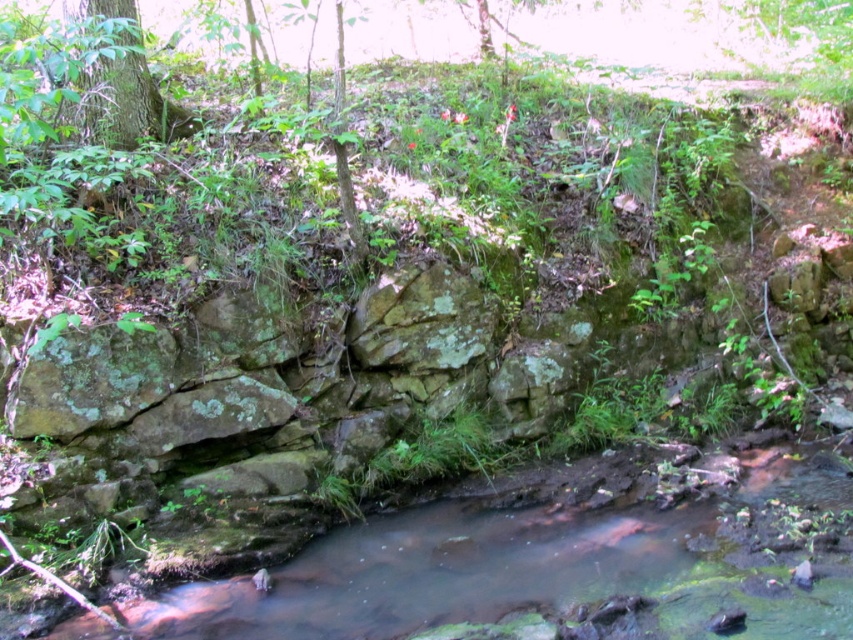
Question: Is clear water at center behind green mossy tree at upper left?

Choices:
 (A) no
 (B) yes

Answer: (A)

Question: Considering the relative positions of clear water at center and green mossy tree at upper left in the image provided, where is clear water at center located with respect to green mossy tree at upper left?

Choices:
 (A) above
 (B) below

Answer: (B)

Question: Does clear water at center have a lesser width compared to green mossy tree at upper left?

Choices:
 (A) no
 (B) yes

Answer: (A)